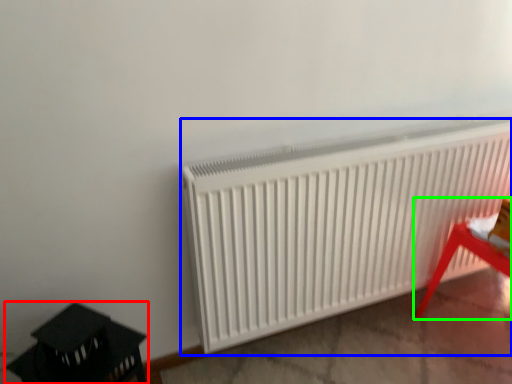
Question: Which is farther away from furniture (highlighted by a red box)? radiator (highlighted by a blue box) or furniture (highlighted by a green box)?

Choices:
 (A) radiator
 (B) furniture

Answer: (B)